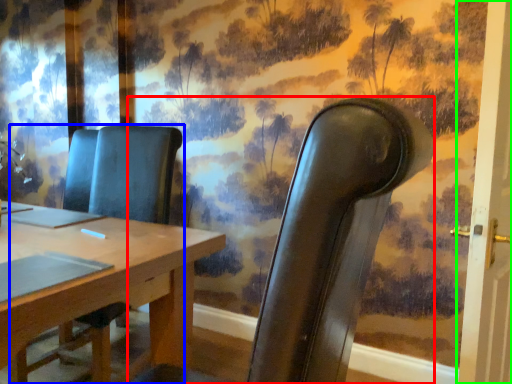
Question: Which is farther away from chair (highlighted by a red box)? chair (highlighted by a blue box) or door (highlighted by a green box)?

Choices:
 (A) chair
 (B) door

Answer: (A)